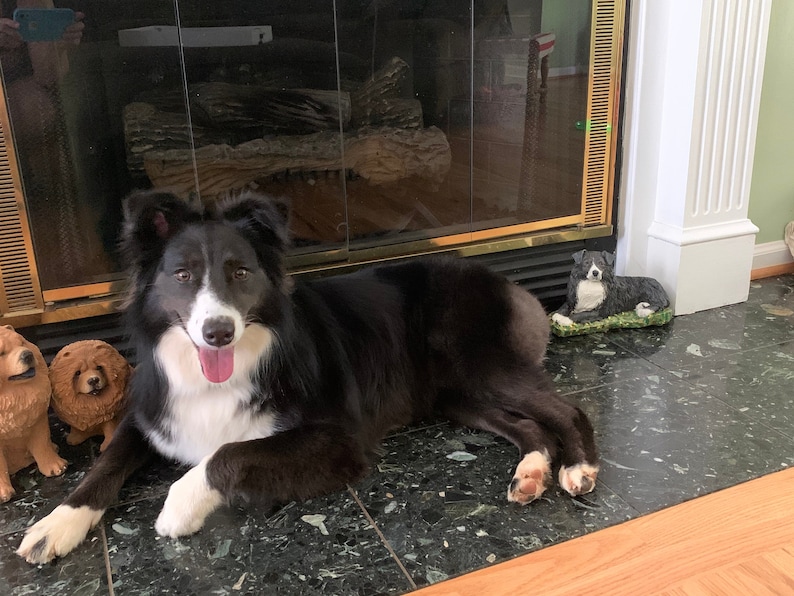
Locate an element on the screen. The height and width of the screenshot is (596, 794). white fireplace column is located at coordinates (723, 110).